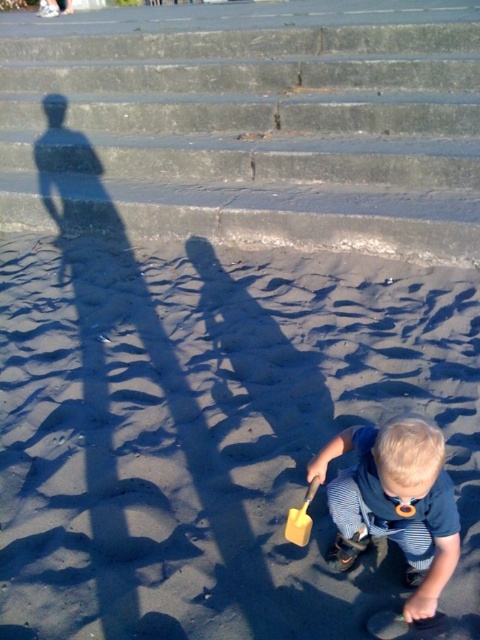
Can you confirm if blue striped shirt at lower center is positioned below yellow matte shovel at lower center?

Incorrect, blue striped shirt at lower center is not positioned below yellow matte shovel at lower center.

Describe the element at coordinates (395, 500) in the screenshot. I see `blue striped shirt at lower center` at that location.

The image size is (480, 640). I want to click on blue striped shirt at lower center, so click(395, 500).

Does fine-grained sand at lower center lie behind yellow matte shovel at lower center?

No, fine-grained sand at lower center is in front of yellow matte shovel at lower center.

Between fine-grained sand at lower center and yellow matte shovel at lower center, which one is positioned higher?

fine-grained sand at lower center is higher up.

Which is behind, point (210, 468) or point (291, 520)?

Point (210, 468)

At what (x,y) coordinates should I click in order to perform the action: click on fine-grained sand at lower center. Please return your answer as a coordinate pair (x, y). The width and height of the screenshot is (480, 640). Looking at the image, I should click on (212, 433).

What do you see at coordinates (250, 136) in the screenshot? This screenshot has height=640, width=480. I see `concrete stairs at upper center` at bounding box center [250, 136].

Who is lower down, concrete stairs at upper center or yellow matte shovel at lower center?

yellow matte shovel at lower center

Which is in front, point (276, 172) or point (301, 506)?

Positioned in front is point (301, 506).

You are a GUI agent. You are given a task and a screenshot of the screen. Output one action in this format:
    pyautogui.click(x=<x>, y=<y>)
    Task: Click on the concrete stairs at upper center
    The image size is (480, 640).
    Given the screenshot: What is the action you would take?
    pyautogui.click(x=250, y=136)